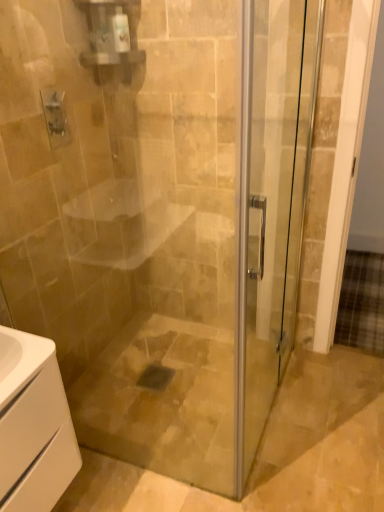
Question: Considering the relative sizes of white matte cabinet at lower left and transparent glass shower door at right in the image provided, is white matte cabinet at lower left wider than transparent glass shower door at right?

Choices:
 (A) no
 (B) yes

Answer: (B)

Question: Considering the relative positions of white matte cabinet at lower left and transparent glass shower door at right in the image provided, is white matte cabinet at lower left to the left of transparent glass shower door at right from the viewer's perspective?

Choices:
 (A) yes
 (B) no

Answer: (A)

Question: Does white matte cabinet at lower left turn towards transparent glass shower door at right?

Choices:
 (A) no
 (B) yes

Answer: (A)

Question: Is white matte cabinet at lower left at the right side of transparent glass shower door at right?

Choices:
 (A) yes
 (B) no

Answer: (B)

Question: From the image's perspective, does white matte cabinet at lower left appear higher than transparent glass shower door at right?

Choices:
 (A) no
 (B) yes

Answer: (A)

Question: Is transparent glass shower door at right a part of white matte cabinet at lower left?

Choices:
 (A) yes
 (B) no

Answer: (B)

Question: Does transparent glass shower door at right appear on the right side of white matte cabinet at lower left?

Choices:
 (A) no
 (B) yes

Answer: (B)

Question: Would you say transparent glass shower door at right is outside white matte cabinet at lower left?

Choices:
 (A) yes
 (B) no

Answer: (A)

Question: Is the position of transparent glass shower door at right less distant than that of white matte cabinet at lower left?

Choices:
 (A) no
 (B) yes

Answer: (B)

Question: From a real-world perspective, is transparent glass shower door at right on white matte cabinet at lower left?

Choices:
 (A) yes
 (B) no

Answer: (A)

Question: Is transparent glass shower door at right smaller than white matte cabinet at lower left?

Choices:
 (A) no
 (B) yes

Answer: (A)

Question: Does transparent glass shower door at right have a lesser width compared to white matte cabinet at lower left?

Choices:
 (A) yes
 (B) no

Answer: (A)

Question: Would you say white matte cabinet at lower left is to the left or to the right of transparent glass shower door at right in the picture?

Choices:
 (A) left
 (B) right

Answer: (A)